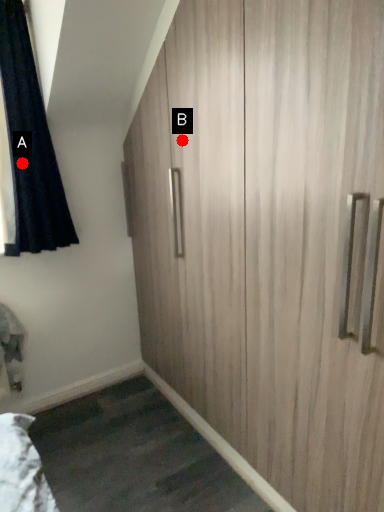
Question: Two points are circled on the image, labeled by A and B beside each circle. Which of the following is the farthest from the observer?

Choices:
 (A) A is further
 (B) B is further

Answer: (A)